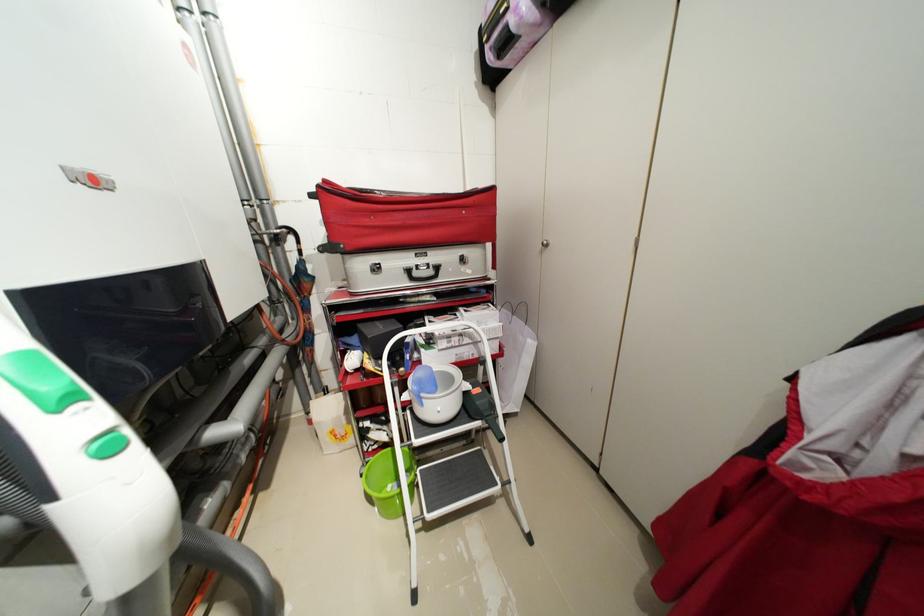
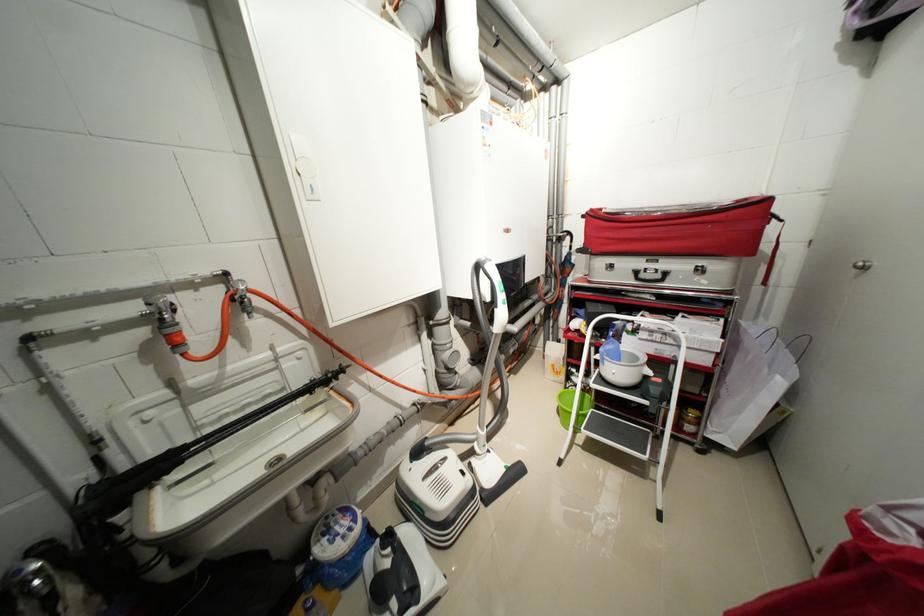
Locate, in the second image, the point that corresponds to point (539, 345) in the first image.

(787, 384)